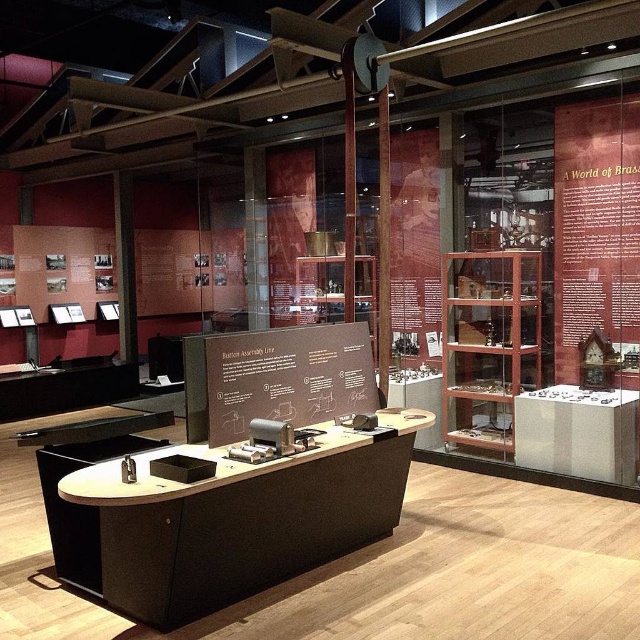
You are a visitor at the museum exhibit and want to read the brown matte signboard at center. However, there is brown paper at upper right blocking your view. Which object should you move to access the signboard?

To access the brown matte signboard at center, you should move the brown paper at upper right, which is blocking it to the right.

You are a visitor at the museum and want to read the text on both the brown paper at upper right and the brown matte signboard at center. Which one do you think has thicker material?

The brown matte signboard at center is thicker than the brown paper at upper right.